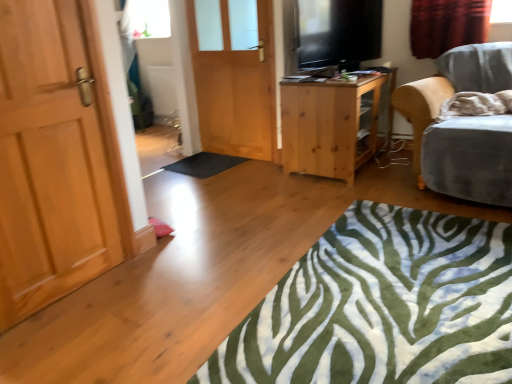
The image size is (512, 384). In order to click on vacant space in between matte wooden door at center, which is the 1th door in back-to-front order, and light brown wooden door at left, the second door positioned from the back in this screenshot , I will do `click(204, 183)`.